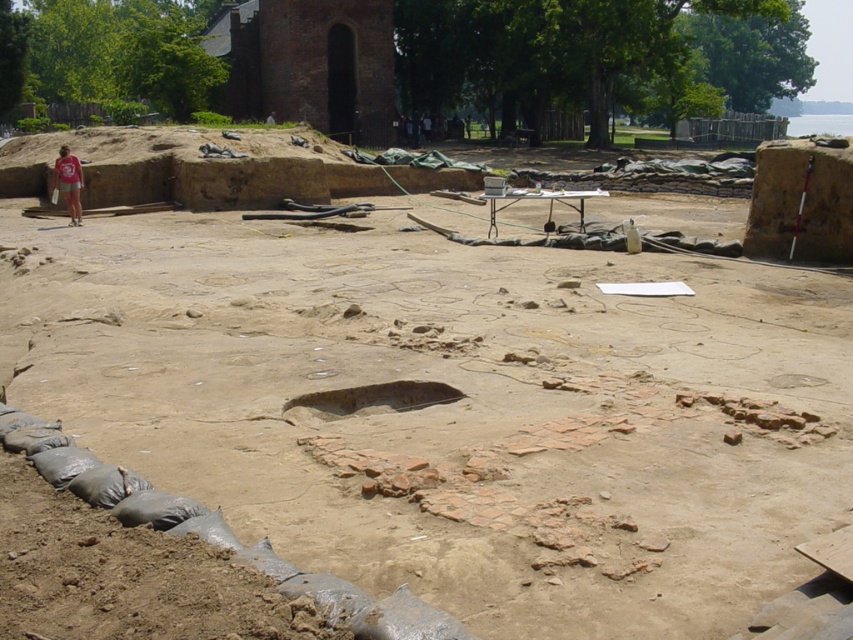
Question: Which point is closer to the camera taking this photo?

Choices:
 (A) (68, 182)
 (B) (567, 605)

Answer: (B)

Question: Which point is farther to the camera?

Choices:
 (A) brown sandy soil at center
 (B) matte pink shirt at left

Answer: (B)

Question: Does brown sandy soil at center appear on the left side of matte pink shirt at left?

Choices:
 (A) yes
 (B) no

Answer: (B)

Question: Is brown sandy soil at center closer to camera compared to matte pink shirt at left?

Choices:
 (A) yes
 (B) no

Answer: (A)

Question: Is brown sandy soil at center bigger than matte pink shirt at left?

Choices:
 (A) no
 (B) yes

Answer: (B)